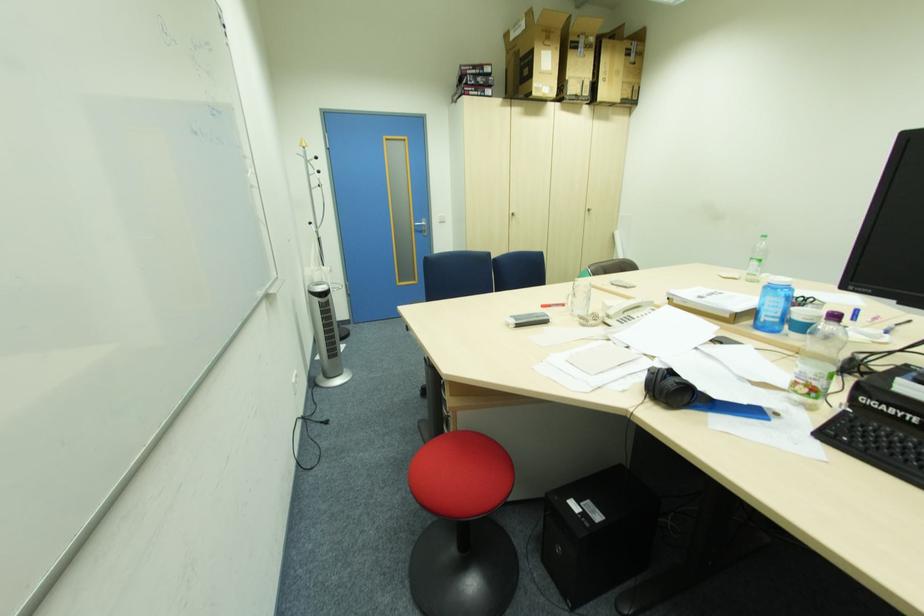
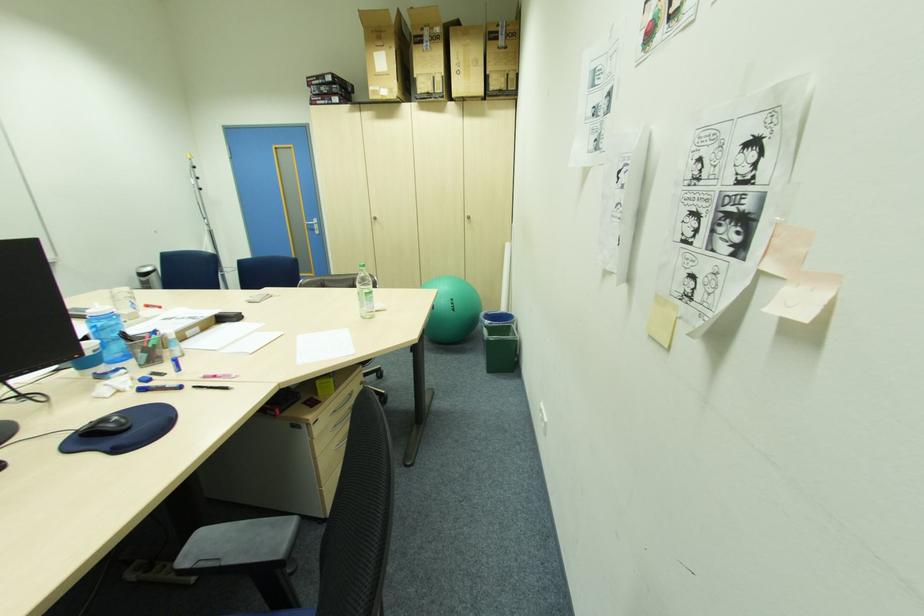
Question: In a continuous first-person perspective shot, in which direction is the camera moving?

Choices:
 (A) Left
 (B) Right
 (C) Forward
 (D) Backward

Answer: (B)